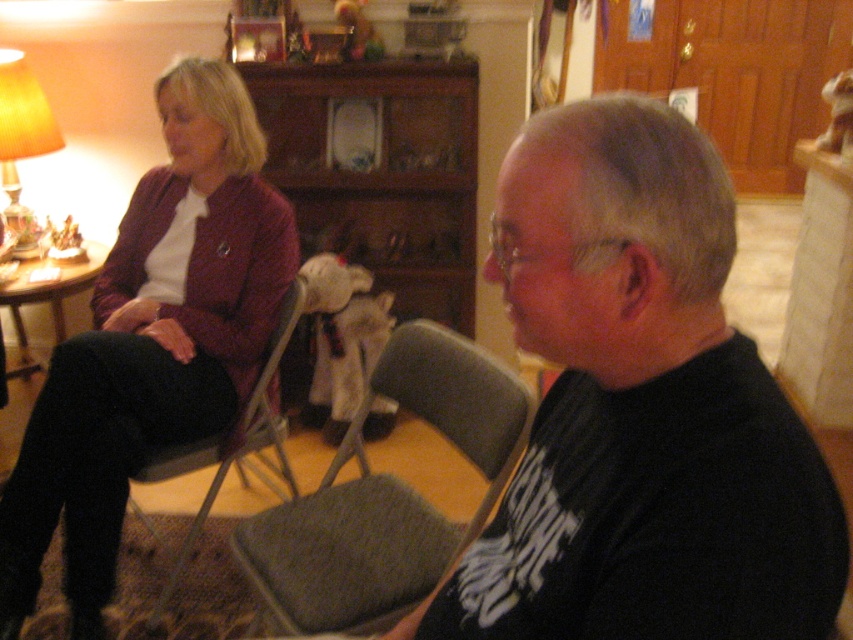
Which is in front, point (181, 470) or point (1, 156)?

Positioned in front is point (181, 470).

Between gray fabric chair at left and matte yellow lampshade at left, which one has more height?

gray fabric chair at left

Does point (213, 448) come farther from viewer compared to point (3, 164)?

No, (213, 448) is closer to viewer.

Where is `gray fabric chair at left`? This screenshot has width=853, height=640. gray fabric chair at left is located at coordinates pos(228,451).

Who is higher up, matte burgundy sweater at left or matte yellow lampshade at left?

Positioned higher is matte yellow lampshade at left.

Who is more distant from viewer, (161, 220) or (36, 124)?

The point (36, 124) is behind.

The image size is (853, 640). In order to click on matte burgundy sweater at left in this screenshot , I will do `click(151, 340)`.

Who is higher up, black matte shirt at center or gray fabric chair at center?

black matte shirt at center is above.

Between black matte shirt at center and gray fabric chair at center, which one has more height?

black matte shirt at center

Find the location of a particular element. This screenshot has height=640, width=853. black matte shirt at center is located at coordinates (639, 410).

Image resolution: width=853 pixels, height=640 pixels. What are the coordinates of `black matte shirt at center` in the screenshot? It's located at (639, 410).